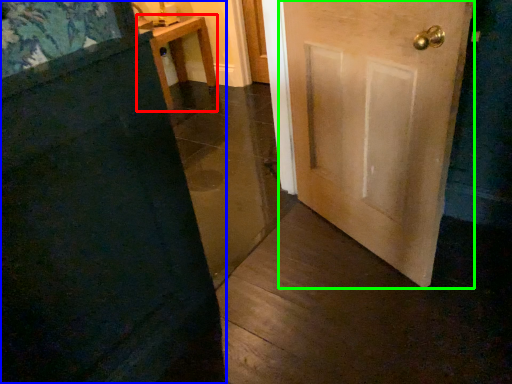
Question: Based on their relative distances, which object is farther from furniture (highlighted by a red box)? Choose from door (highlighted by a blue box) and door (highlighted by a green box).

Choices:
 (A) door
 (B) door

Answer: (A)